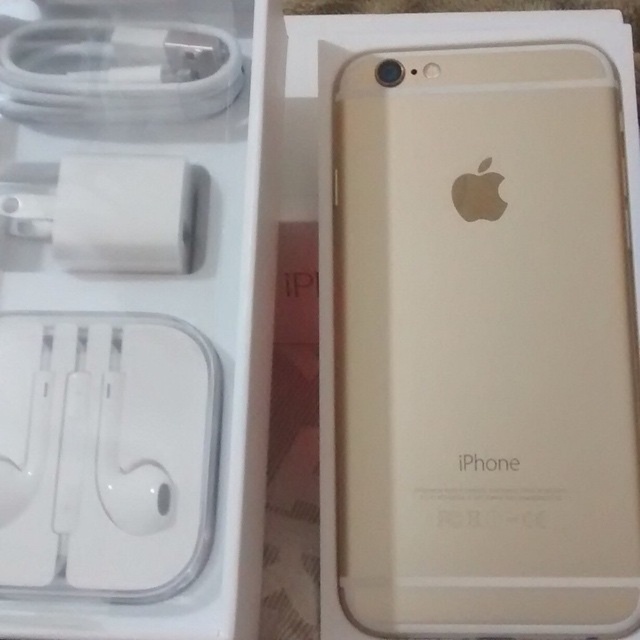
You are a customer looking at the iPhone packaging. You want to know where the white matte earphones at left are located relative to the gold matte iPhone at center. Can you tell me?

The gold matte iPhone at center is to the right of white matte earphones at left, so the white matte earphones at left are located to the left of the gold matte iPhone at center.

In the scene shown: You are a delivery person who needs to verify the distance between the gold matte iphone at center and the white matte earphones at left in the box. The customer requires that these items must be at least 12 inches apart for safety. Can you confirm if they meet this requirement?

The gold matte iphone at center and white matte earphones at left are 13.76 inches apart from each other, which exceeds the required 12 inches, so they meet the safety requirement.